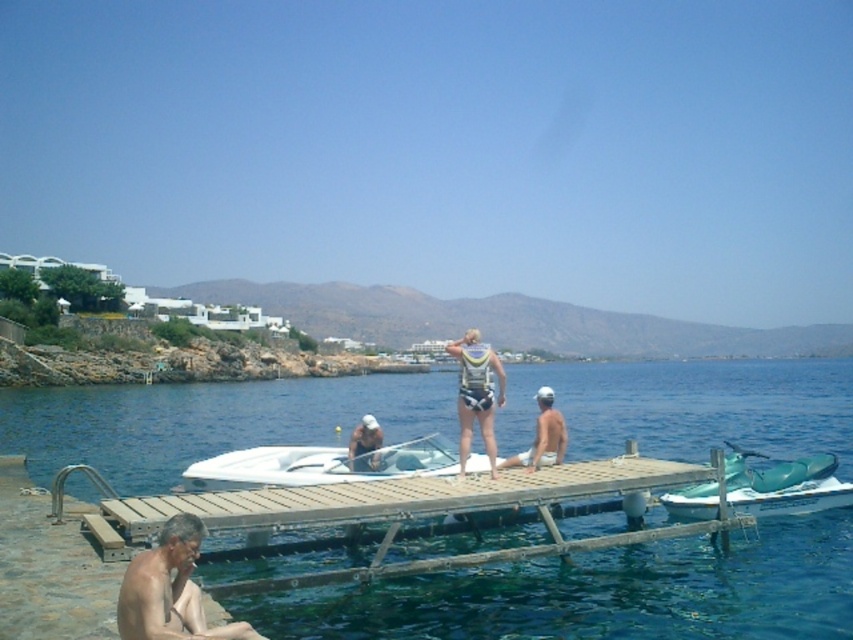
Question: Which object is positioned farthest from the teal plastic jet ski at lower right?

Choices:
 (A) wooden dock at center
 (B) white glossy boat at center
 (C) gray hairless skin at lower left

Answer: (C)

Question: Observing the image, what is the correct spatial positioning of teal plastic jet ski at lower right in reference to white fabric life vest at center?

Choices:
 (A) right
 (B) left

Answer: (A)

Question: Can you confirm if wooden dock at center is thinner than white fabric life vest at center?

Choices:
 (A) no
 (B) yes

Answer: (A)

Question: Does gray hairless skin at lower left come behind white fabric cap at center?

Choices:
 (A) no
 (B) yes

Answer: (A)

Question: Which object appears farthest from the camera in this image?

Choices:
 (A) white matte swimwear at center
 (B) wooden dock at center
 (C) blue water at center
 (D) white glossy boat at center

Answer: (A)

Question: Among these objects, which one is nearest to the camera?

Choices:
 (A) white fabric cap at center
 (B) blue water at center

Answer: (B)